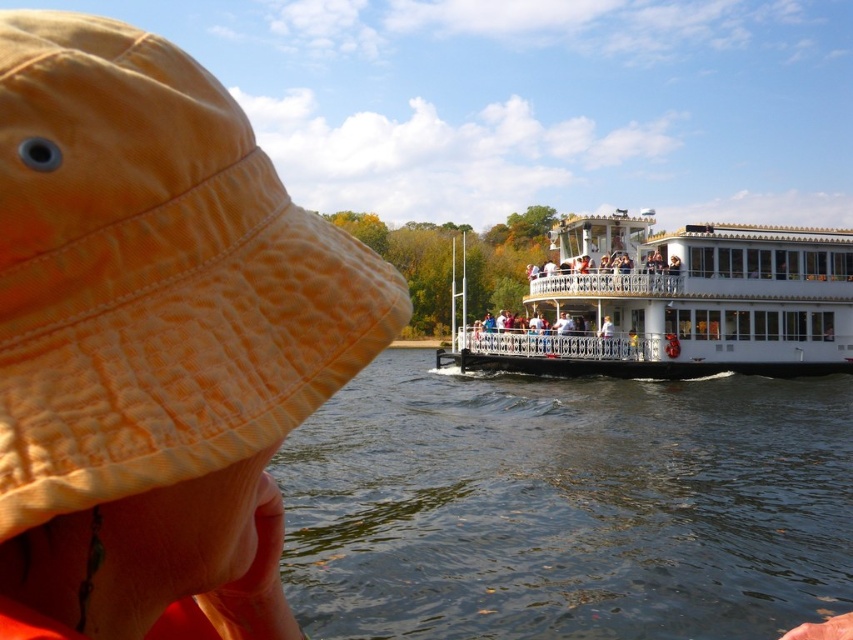
Can you confirm if orange cotton hat at left is positioned above white glossy boat at center?

Incorrect, orange cotton hat at left is not positioned above white glossy boat at center.

Does orange cotton hat at left come in front of white glossy boat at center?

That is True.

Between point (80, 113) and point (579, 253), which one is positioned in front?

Point (80, 113) is more forward.

Identify the location of orange cotton hat at left. The height and width of the screenshot is (640, 853). (154, 275).

Measure the distance between dark blue water at center and camera.

A distance of 6.84 meters exists between dark blue water at center and camera.

Find the location of a particular element. dark blue water at center is located at coordinates (567, 506).

Can you confirm if dark blue water at center is bigger than white glossy boat at center?

Indeed, dark blue water at center has a larger size compared to white glossy boat at center.

Looking at this image, between dark blue water at center and white glossy boat at center, which one is positioned higher?

white glossy boat at center is higher up.

Locate an element on the screen. Image resolution: width=853 pixels, height=640 pixels. dark blue water at center is located at coordinates (567, 506).